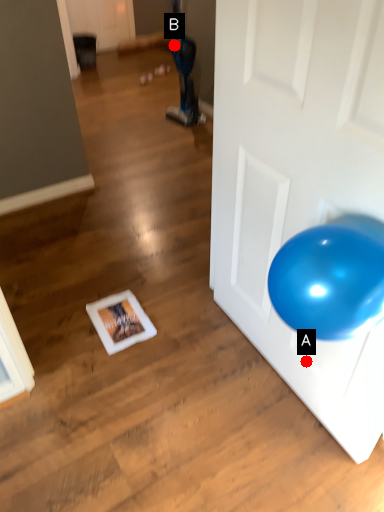
Question: Two points are circled on the image, labeled by A and B beside each circle. Which point is further to the camera?

Choices:
 (A) A is further
 (B) B is further

Answer: (B)